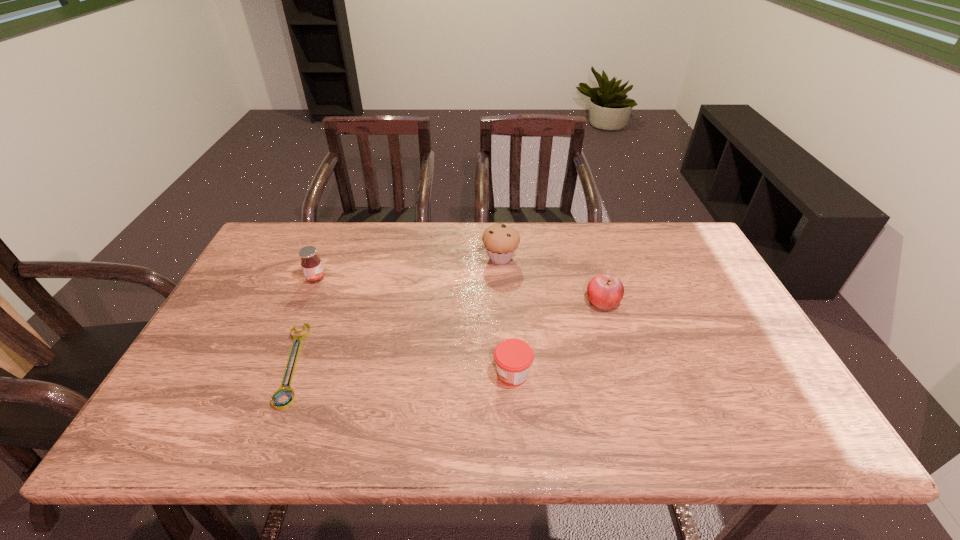
You are a GUI agent. You are given a task and a screenshot of the screen. Output one action in this format:
    pyautogui.click(x=<x>, y=<y>)
    Task: Click on the free spot between the muffin and the third nearest object
    The image size is (960, 540).
    Given the screenshot: What is the action you would take?
    pyautogui.click(x=552, y=280)

At what (x,y) coordinates should I click in order to perform the action: click on object that ranks as the third closest to the apple. Please return your answer as a coordinate pair (x, y). This screenshot has height=540, width=960. Looking at the image, I should click on (281, 391).

Identify which object is the third nearest to the wrench. Please provide its 2D coordinates. Your answer should be formatted as a tuple, i.e. [(x, y)], where the tuple contains the x and y coordinates of a point satisfying the conditions above.

[(501, 242)]

Find the location of a particular element. This screenshot has height=540, width=960. free spot that satisfies the following two spatial constraints: 1. on the front side of the farthest object; 2. on the label side of the taller jam is located at coordinates tap(502, 279).

Locate an element on the screen. This screenshot has height=540, width=960. vacant area that satisfies the following two spatial constraints: 1. on the label side of the farther jam; 2. on the left side of the third nearest object is located at coordinates (306, 301).

You are a GUI agent. You are given a task and a screenshot of the screen. Output one action in this format:
    pyautogui.click(x=<x>, y=<y>)
    Task: Click on the free space that satisfies the following two spatial constraints: 1. on the back side of the shortest object; 2. on the label side of the left jam
    The image size is (960, 540).
    Given the screenshot: What is the action you would take?
    (327, 279)

Where is `free region that satisfies the following two spatial constraints: 1. on the label side of the farther jam; 2. on the back side of the rightmost object`? This screenshot has height=540, width=960. free region that satisfies the following two spatial constraints: 1. on the label side of the farther jam; 2. on the back side of the rightmost object is located at coordinates (306, 301).